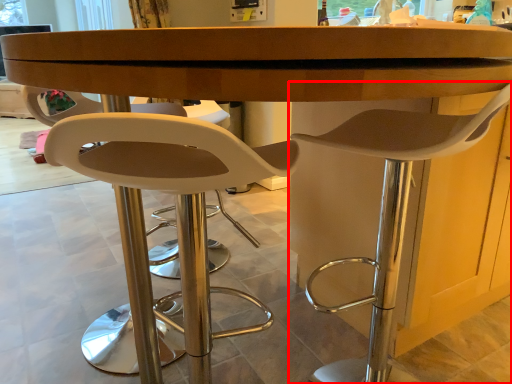
Question: Considering the relative positions of chair (annotated by the red box) and chair in the image provided, where is chair (annotated by the red box) located with respect to the staircase?

Choices:
 (A) right
 (B) left

Answer: (A)